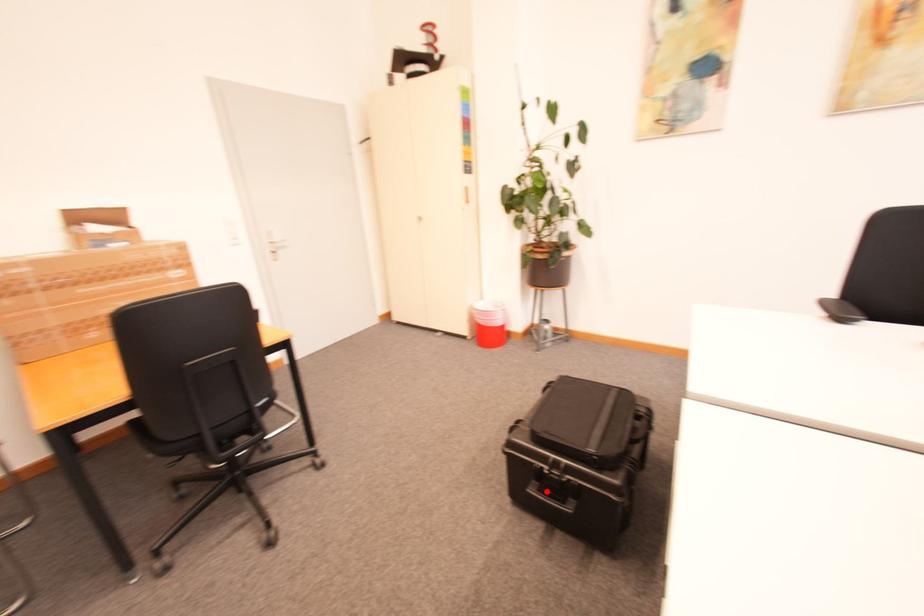
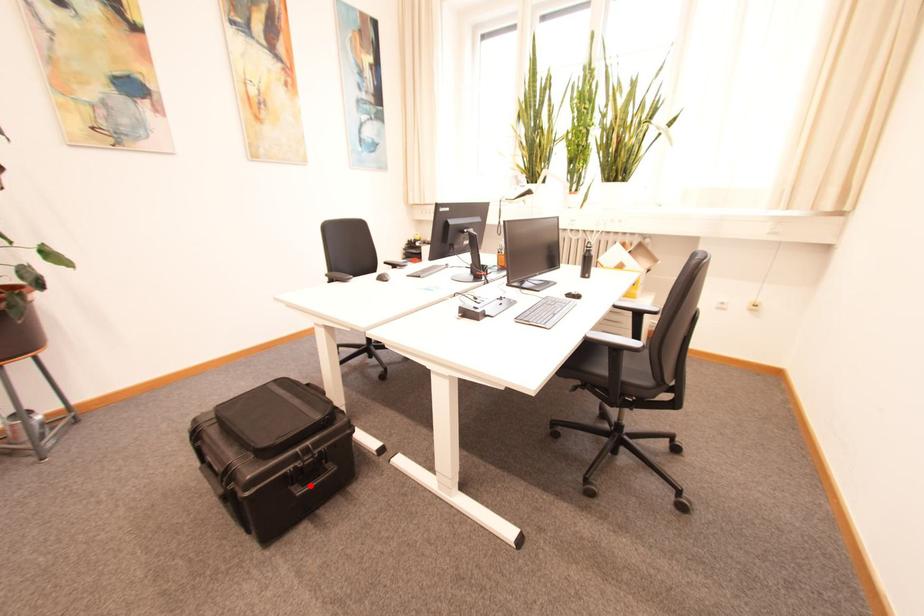
I am providing you with two images of the same scene from different viewpoints. A red point is marked on the first image and another point is marked on the second image. Do the highlighted points in image1 and image2 indicate the same real-world spot?

Yes